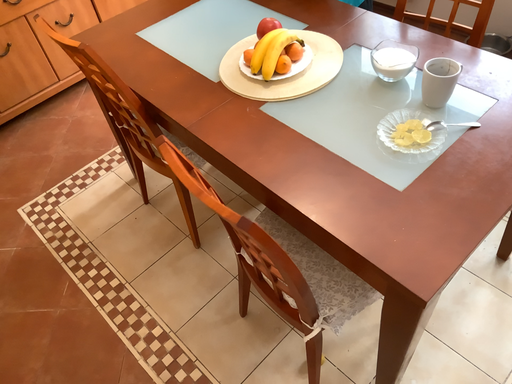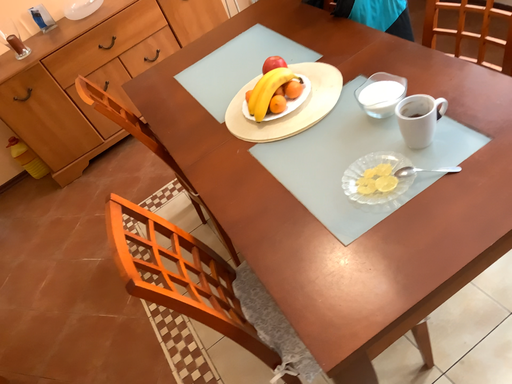
Question: Which way did the camera rotate in the video?

Choices:
 (A) rotated left
 (B) rotated right

Answer: (A)